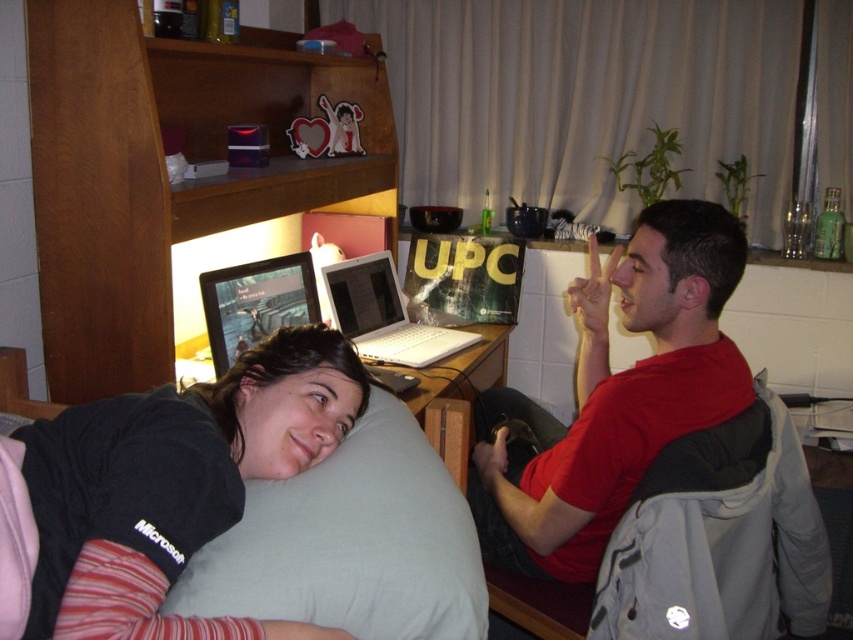
You are standing in the dorm room scene. The black fabric pillow at lower left is located at coordinates 0.758, 0.206. If you want to place a small book on the pillow, where should you aim?

You should aim for the coordinates (x=175, y=484) where the black fabric pillow at lower left is located to place the small book.

You are standing in the dorm room and want to place a small plant between the two points, point (59, 525) and point (556, 545). Which point should the plant be closer to so it is nearer to the viewer?

The plant should be placed closer to point (59, 525) because it is closer to the viewer than point (556, 545).

You are organizing the dorm room and need to move the white plastic laptop at center. Where is the black fabric pillow at lower left located in relation to the laptop?

The black fabric pillow at lower left is positioned under the white plastic laptop at center, so moving the laptop would require lifting it off the pillow.